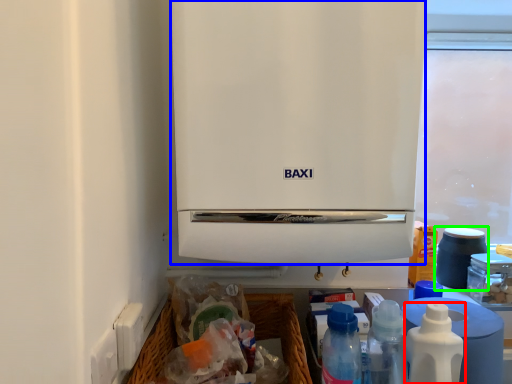
Question: Estimate the real-world distances between objects in this image. Which object is closer to bottle (highlighted by a red box), home appliance (highlighted by a blue box) or appliance (highlighted by a green box)?

Choices:
 (A) home appliance
 (B) appliance

Answer: (A)